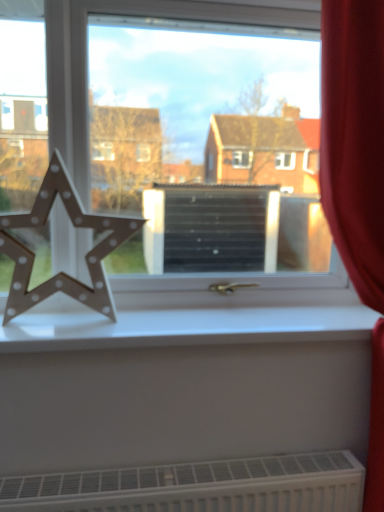
Question: Is red velvet curtain at right spatially inside wooden star at left, or outside of it?

Choices:
 (A) outside
 (B) inside

Answer: (A)

Question: From the image's perspective, is red velvet curtain at right located above or below wooden star at left?

Choices:
 (A) above
 (B) below

Answer: (B)

Question: Based on their relative distances, which object is farther from the metallic star at left?

Choices:
 (A) red velvet curtain at right
 (B) white matte window sill at center
 (C) wooden star at left

Answer: (A)

Question: Which object is the farthest from the wooden star at left?

Choices:
 (A) red velvet curtain at right
 (B) metallic star at left
 (C) white matte window sill at center

Answer: (A)